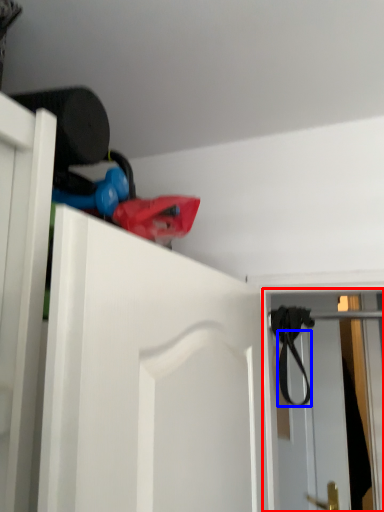
Question: Which point is closer to the camera, screen door (highlighted by a red box) or strap (highlighted by a blue box)?

Choices:
 (A) screen door
 (B) strap

Answer: (B)